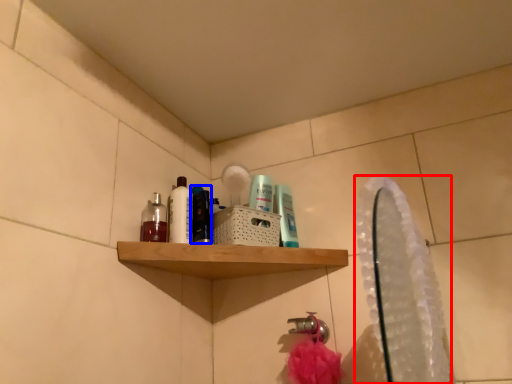
Question: Which point is further to the camera, mirror (highlighted by a red box) or mouthwash (highlighted by a blue box)?

Choices:
 (A) mirror
 (B) mouthwash

Answer: (B)